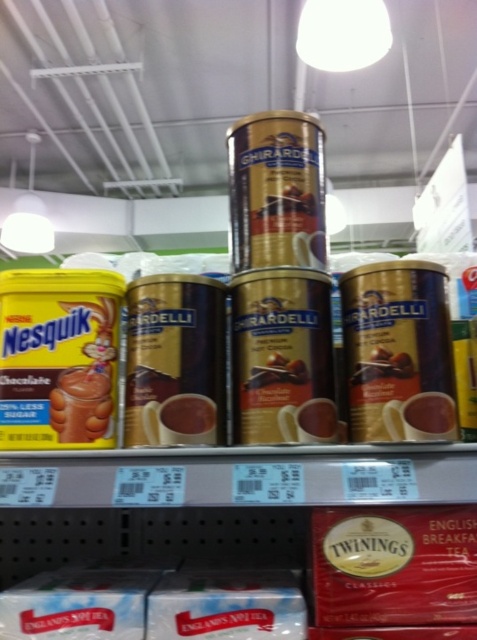
You are a grocery store employee restocking shelves. You have a new box of yellow matte nesquik chocolate at left and a metallic gold canister at center to place on a shelf. The shelf has limited width. Based on the image, which item requires more horizontal space?

The yellow matte nesquik chocolate at left might be wider than metallic gold canister at center, so it requires more horizontal space.

You are a grocery store employee restocking shelves. You need to place a new box of Twinings tea bags on the shelf. The box is the same size as the Twinings English Breakfast tea bags already there. Where should you place it in relation to the gold metallic canister at center and the shiny metallic canister at center?

The gold metallic canister at center is below the shiny metallic canister at center. Since the Twinings tea bags are on the shelf below the Ghirardelli hot cocoa cans, you should place the new box of Twinings tea bags on the shelf below both the gold metallic canister at center and the shiny metallic canister at center.